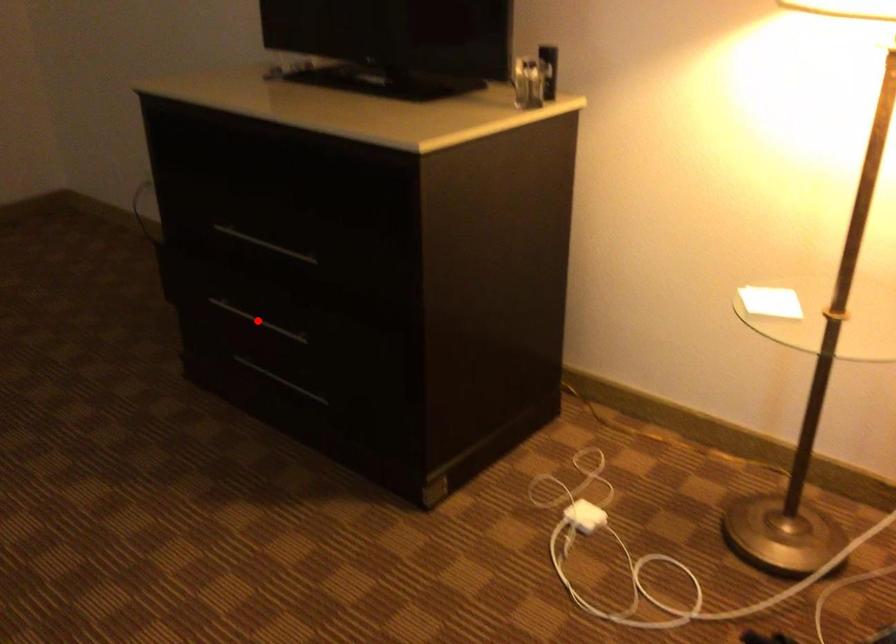
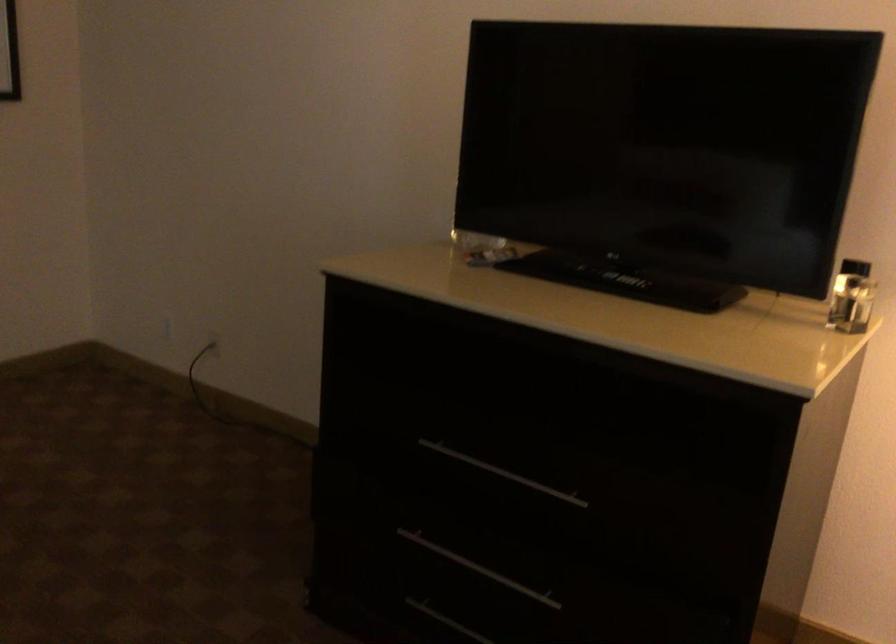
Where in the second image is the point corresponding to the highlighted location from the first image?

(478, 567)